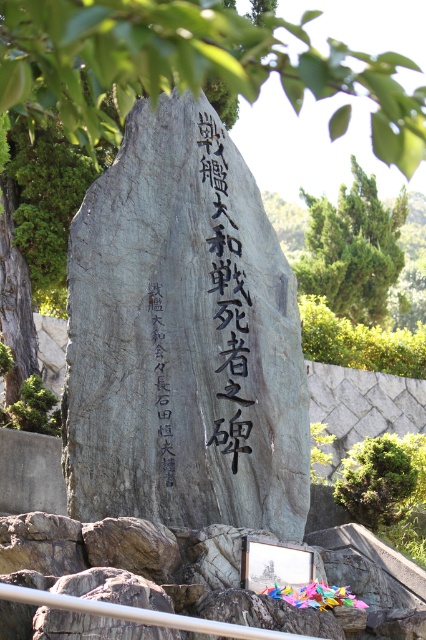
You are a visitor standing at the metal rail at lower center, wanting to touch the black carved stone at center. Can you reach it without moving from your current position? Please explain your reasoning.

The black carved stone at center is 9.44 meters away from the metal rail at lower center. Since 9.44 meters is a significant distance, you cannot reach the stone by merely stretching your arm from the metal rail at lower center. You would need to move closer to touch it.

You are standing at the monument and want to take a photo of the paper cranes. The camera you have can only focus on objects within 20 meters. Is the point where the paper cranes are located, which is at point (245, 476), within the camera focus range?

The distance of point (245, 476) from the viewer is 18.00 meters, which is within the camera focus range of 20 meters. Yes, the camera can focus on the paper cranes at that point.

Based on the scene, which object takes up more area in the image between the gray stone monument at center and the green leafy tree at upper left?

The green leafy tree at upper left occupies more space than the gray stone monument at center according to the description.